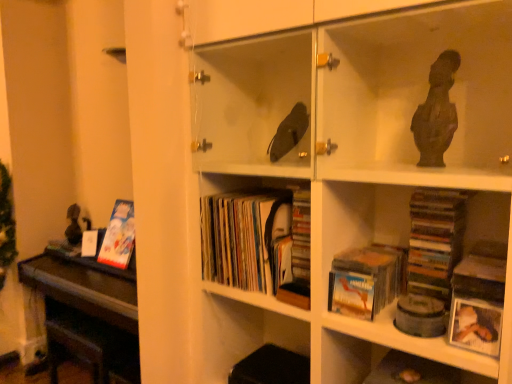
Identify the location of matte cardboard book at lower center, the third book viewed from the back. This screenshot has width=512, height=384. coord(365,280).

In order to face matte cardboard book at left, which is the third book from right to left, should I rotate leftwards or rightwards?

Turn left by 16.775 degrees to look at matte cardboard book at left, which is the third book from right to left.

Image resolution: width=512 pixels, height=384 pixels. What do you see at coordinates (475, 325) in the screenshot? I see `white matte photo frame at lower right` at bounding box center [475, 325].

In order to click on matte paper books at center, which ranks as the 2th book in back-to-front order in this screenshot , I will do `click(247, 239)`.

This screenshot has width=512, height=384. In order to click on matte cardboard book at lower center, arranged as the third book when viewed from the left in this screenshot , I will do `click(365, 280)`.

From a real-world perspective, which object rests below the other?

From a 3D spatial view, dark brown polished wood table at left is below.

Is matte cardboard book at lower center, the third book viewed from the back, bigger than dark brown polished wood table at left?

No.

From the picture: Which is more to the left, matte cardboard book at lower center, arranged as the third book when viewed from the left, or dark brown polished wood table at left?

From the viewer's perspective, dark brown polished wood table at left appears more on the left side.

Considering the points (403, 253) and (54, 277), which point is in front, point (403, 253) or point (54, 277)?

Positioned in front is point (403, 253).

Between point (239, 231) and point (114, 239), which one is positioned in front?

Point (239, 231)

Does matte paper books at center, which is the second book from right to left, lie behind matte cardboard book at left, the 1th book positioned from the left?

No, it is not.

At what (x,y) coordinates should I click in order to perform the action: click on the 1st book in front of the matte cardboard book at left, which is the third book from right to left, starting your count from the anchor. Please return your answer as a coordinate pair (x, y). Image resolution: width=512 pixels, height=384 pixels. Looking at the image, I should click on (247, 239).

Based on their positions, is matte cardboard book at lower center, arranged as the third book when viewed from the left, located to the left or right of matte cardboard book at left, arranged as the first book when viewed from the back?

Clearly, matte cardboard book at lower center, arranged as the third book when viewed from the left, is on the right of matte cardboard book at left, arranged as the first book when viewed from the back, in the image.

Between matte cardboard book at lower center, the third book viewed from the back, and matte cardboard book at left, which is the 3th book from front to back, which one has smaller size?

matte cardboard book at lower center, the third book viewed from the back, is smaller.

From the image's perspective, who appears lower, matte cardboard book at lower center, arranged as the third book when viewed from the left, or matte cardboard book at left, which is the 3th book from front to back?

From the image's view, matte cardboard book at lower center, arranged as the third book when viewed from the left, is below.

Considering the relative sizes of matte paper books at center, which appears as the 2th book when viewed from the left, and dark brown polished wood table at left in the image provided, is matte paper books at center, which appears as the 2th book when viewed from the left, taller than dark brown polished wood table at left?

Incorrect, the height of matte paper books at center, which appears as the 2th book when viewed from the left, is not larger of that of dark brown polished wood table at left.

Considering the points (283, 253) and (122, 289), which point is in front, point (283, 253) or point (122, 289)?

The point (283, 253) is more forward.

What's the angular difference between matte paper books at center, which appears as the 2th book when viewed from the left, and dark brown polished wood table at left's facing directions?

0.271 degrees separate the facing orientations of matte paper books at center, which appears as the 2th book when viewed from the left, and dark brown polished wood table at left.

Which is correct: matte paper books at center, which is the second book from right to left, is inside dark brown polished wood table at left, or outside of it?

matte paper books at center, which is the second book from right to left, exists outside the volume of dark brown polished wood table at left.

How many degrees apart are the facing directions of matte cardboard book at left, arranged as the first book when viewed from the back, and dark brown polished wood table at left?

matte cardboard book at left, arranged as the first book when viewed from the back, and dark brown polished wood table at left are facing 0.352 degrees away from each other.

Does matte cardboard book at left, which is the third book from right to left, turn towards dark brown polished wood table at left?

No.

From the image's perspective, is matte cardboard book at left, the 1th book positioned from the left, above or below dark brown polished wood table at left?

matte cardboard book at left, the 1th book positioned from the left, is situated higher than dark brown polished wood table at left in the image.

Between point (104, 237) and point (81, 341), which one is positioned in front?

Positioned in front is point (81, 341).

Would you say dark brown polished wood table at left is to the left or to the right of matte cardboard book at left, which is the third book from right to left, in the picture?

Clearly, dark brown polished wood table at left is on the left of matte cardboard book at left, which is the third book from right to left, in the image.

Considering the sizes of objects dark brown polished wood table at left and matte cardboard book at left, the 1th book positioned from the left, in the image provided, who is thinner, dark brown polished wood table at left or matte cardboard book at left, the 1th book positioned from the left,?

With smaller width is matte cardboard book at left, the 1th book positioned from the left.

Consider the image. Is dark brown polished wood table at left taller or shorter than matte cardboard book at left, the 1th book positioned from the left?

Considering their sizes, dark brown polished wood table at left has more height than matte cardboard book at left, the 1th book positioned from the left.

Does dark brown polished wood table at left touch matte cardboard book at left, which is the 3th book from front to back?

No, dark brown polished wood table at left is not touching matte cardboard book at left, which is the 3th book from front to back.

Between dark brown polished wood table at left and white matte photo frame at lower right, which one is positioned behind?

dark brown polished wood table at left is further from the camera.

From a real-world perspective, relative to white matte photo frame at lower right, is dark brown polished wood table at left vertically above or below?

dark brown polished wood table at left is below white matte photo frame at lower right.

Where is `book that is the 2nd object located in front of the dark brown polished wood table at left`? The height and width of the screenshot is (384, 512). book that is the 2nd object located in front of the dark brown polished wood table at left is located at coordinates (365, 280).

Find the location of a particular element. The width and height of the screenshot is (512, 384). book located above the matte cardboard book at left, which is the third book from right to left (from the image's perspective) is located at coordinates (247, 239).

Estimate the real-world distances between objects in this image. Which object is further from dark brown polished wood table at left, matte cardboard book at left, which is the 3th book from front to back, or matte paper books at center, which ranks as the 2th book in back-to-front order?

matte paper books at center, which ranks as the 2th book in back-to-front order, is positioned further to the anchor dark brown polished wood table at left.

Considering their positions, is dark brown polished wood table at left positioned closer to matte cardboard book at left, which is the 3th book from front to back, than white matte photo frame at lower right?

dark brown polished wood table at left is closer to matte cardboard book at left, which is the 3th book from front to back.

When comparing their distances from matte cardboard book at lower center, arranged as the third book when viewed from the left, does matte cardboard book at left, which is the 3th book from front to back, or matte paper books at center, the second book viewed from the front, seem closer?

Based on the image, matte paper books at center, the second book viewed from the front, appears to be nearer to matte cardboard book at lower center, arranged as the third book when viewed from the left.

Looking at the image, which one is located further to white matte photo frame at lower right, matte cardboard book at lower center, the 1th book viewed from the front, or matte paper books at center, which is the second book from right to left?

Among the two, matte paper books at center, which is the second book from right to left, is located further to white matte photo frame at lower right.

Looking at the image, which one is located further to matte cardboard book at left, which is the third book from right to left, white matte photo frame at lower right or matte paper books at center, which is the second book from right to left?

The object further to matte cardboard book at left, which is the third book from right to left, is white matte photo frame at lower right.

Which object lies further to the anchor point matte cardboard book at left, which is the third book from right to left, dark brown polished wood table at left or matte paper books at center, which ranks as the 2th book in back-to-front order?

matte paper books at center, which ranks as the 2th book in back-to-front order, is further to matte cardboard book at left, which is the third book from right to left.

From the image, which object appears to be farther from white matte photo frame at lower right, matte cardboard book at left, the 1th book positioned from the left, or matte cardboard book at lower center, acting as the 1th book starting from the right?

matte cardboard book at left, the 1th book positioned from the left, is further to white matte photo frame at lower right.

Looking at the image, which one is located closer to matte paper books at center, which is the second book from right to left, white matte photo frame at lower right or matte cardboard book at lower center, arranged as the third book when viewed from the left?

matte cardboard book at lower center, arranged as the third book when viewed from the left, lies closer to matte paper books at center, which is the second book from right to left, than the other object.

This screenshot has height=384, width=512. I want to click on book positioned between matte cardboard book at lower center, acting as the 1th book starting from the right, and matte cardboard book at left, arranged as the first book when viewed from the back, from near to far, so click(247, 239).

Image resolution: width=512 pixels, height=384 pixels. Find the location of `table positioned between matte paper books at center, which ranks as the 2th book in back-to-front order, and matte cardboard book at left, arranged as the first book when viewed from the back, from near to far`. table positioned between matte paper books at center, which ranks as the 2th book in back-to-front order, and matte cardboard book at left, arranged as the first book when viewed from the back, from near to far is located at coordinates (87, 309).

Find the location of `book between matte paper books at center, the second book viewed from the front, and white matte photo frame at lower right, in the horizontal direction`. book between matte paper books at center, the second book viewed from the front, and white matte photo frame at lower right, in the horizontal direction is located at coordinates (365, 280).